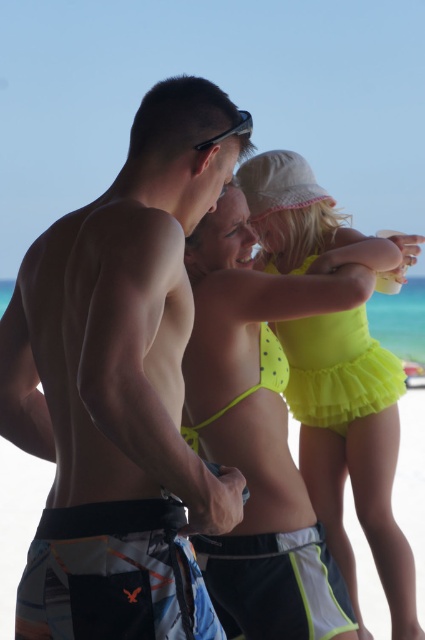
Question: Does matte swim trunks at center appear on the left side of yellow tulle skirt at lower center?

Choices:
 (A) yes
 (B) no

Answer: (A)

Question: Which point is farther from the camera taking this photo?

Choices:
 (A) (210, 138)
 (B) (155, 554)
 (C) (170, 252)
 (D) (333, 372)

Answer: (D)

Question: Is matte swim trunks at center below neon green fabric shorts at lower center?

Choices:
 (A) yes
 (B) no

Answer: (B)

Question: Which of the following is the closest to the observer?

Choices:
 (A) neon yellow swimsuit at center
 (B) neon green fabric shorts at lower center

Answer: (B)

Question: Among these points, which one is nearest to the camera?

Choices:
 (A) (127, 502)
 (B) (314, 364)
 (C) (28, 576)
 (D) (210, 138)

Answer: (A)

Question: Is neon yellow swimsuit at center thinner than matte black goggles at upper center?

Choices:
 (A) no
 (B) yes

Answer: (A)